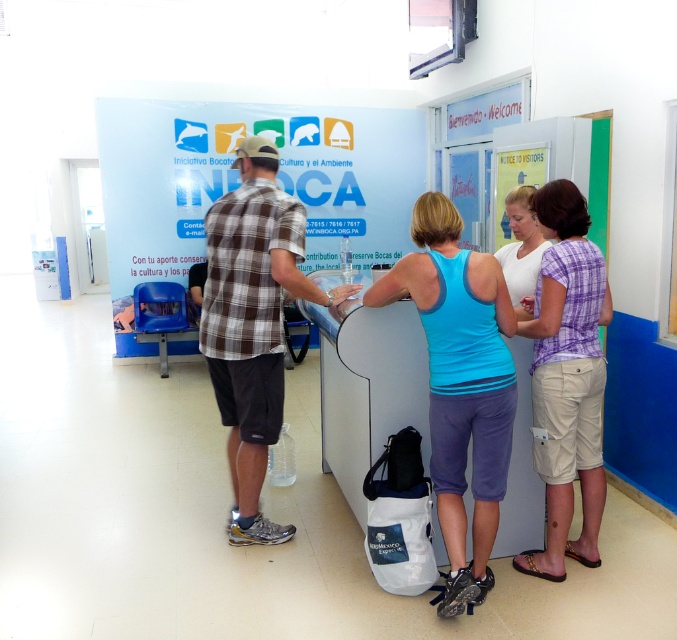
How far apart are brown plaid shirt at center and beige cotton shorts at center?

brown plaid shirt at center is 1.30 meters away from beige cotton shorts at center.

Between brown plaid shirt at center and beige cotton shorts at center, which one has more height?

With more height is brown plaid shirt at center.

Between point (282, 237) and point (582, 220), which one is positioned behind?

Point (282, 237)

The height and width of the screenshot is (640, 677). What are the coordinates of `brown plaid shirt at center` in the screenshot? It's located at (253, 323).

Does blue fabric tank top at center appear under brown plaid shirt at center?

Indeed, blue fabric tank top at center is positioned under brown plaid shirt at center.

Find the location of a particular element. This screenshot has width=677, height=640. blue fabric tank top at center is located at coordinates (460, 384).

Find the location of a particular element. This screenshot has height=640, width=677. blue fabric tank top at center is located at coordinates (460, 384).

Image resolution: width=677 pixels, height=640 pixels. What do you see at coordinates (460, 384) in the screenshot?
I see `blue fabric tank top at center` at bounding box center [460, 384].

Is blue fabric tank top at center bigger than beige cotton shorts at center?

Yes, blue fabric tank top at center is bigger than beige cotton shorts at center.

At what (x,y) coordinates should I click in order to perform the action: click on blue fabric tank top at center. Please return your answer as a coordinate pair (x, y). This screenshot has width=677, height=640. Looking at the image, I should click on (460, 384).

Image resolution: width=677 pixels, height=640 pixels. In order to click on blue fabric tank top at center in this screenshot , I will do `click(460, 384)`.